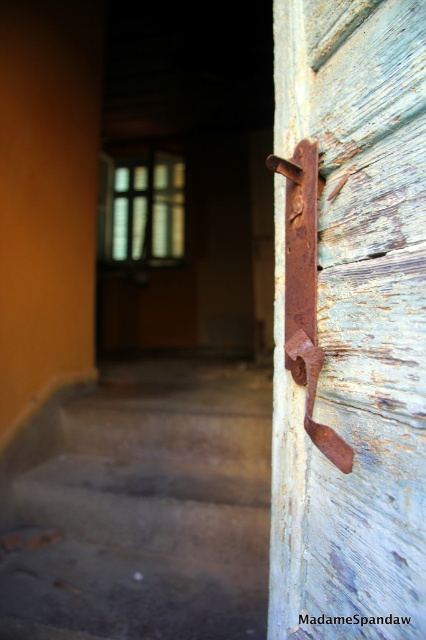
Is rusty metal handle at right smaller than concrete stairs at lower left?

Correct, rusty metal handle at right occupies less space than concrete stairs at lower left.

Who is taller, rusty metal handle at right or concrete stairs at lower left?

rusty metal handle at right is taller.

Who is more distant from viewer, (403, 216) or (175, 536)?

The point (175, 536) is behind.

What are the coordinates of `rusty metal handle at right` in the screenshot? It's located at (348, 321).

Measure the distance between rusty metal handle at right and rusty metal door handle at right.

They are 3.68 inches apart.

The width and height of the screenshot is (426, 640). Find the location of `rusty metal handle at right`. rusty metal handle at right is located at coordinates tap(348, 321).

This screenshot has width=426, height=640. Describe the element at coordinates (348, 321) in the screenshot. I see `rusty metal handle at right` at that location.

Locate an element on the screen. rusty metal handle at right is located at coordinates (348, 321).

Is concrete stairs at lower left smaller than rusty metal door handle at right?

No, concrete stairs at lower left is not smaller than rusty metal door handle at right.

Does concrete stairs at lower left come in front of rusty metal door handle at right?

No.

Is point (183, 598) positioned behind point (313, 378)?

Yes, point (183, 598) is farther from viewer.

Image resolution: width=426 pixels, height=640 pixels. I want to click on concrete stairs at lower left, so click(141, 506).